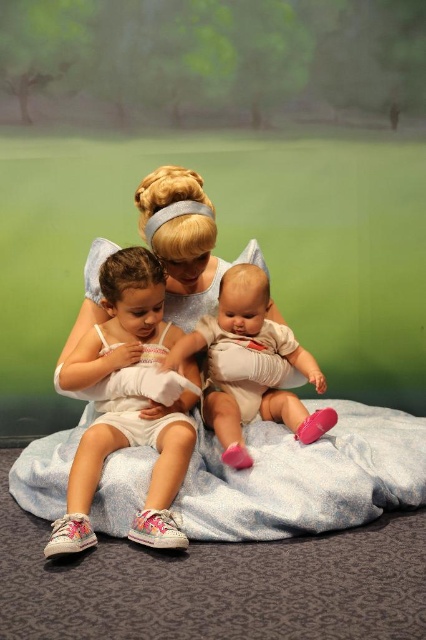
Is white soft blanket at center above white fabric dress at center?

Actually, white soft blanket at center is below white fabric dress at center.

Who is more distant from viewer, (399, 444) or (86, 445)?

Point (399, 444)

Find the location of a particular element. This screenshot has width=426, height=640. white soft blanket at center is located at coordinates (305, 476).

Who is more forward, (115, 410) or (230, 404)?

Point (115, 410)

Is point (147, 276) less distant than point (258, 337)?

That is True.

Identify the location of white fabric dress at center. The width and height of the screenshot is (426, 640). (126, 404).

Which of these two, white soft blanket at center or white cotton baby at center, stands shorter?

white soft blanket at center is shorter.

Who is more forward, (333, 400) or (307, 417)?

Positioned in front is point (307, 417).

Find the location of a particular element. white soft blanket at center is located at coordinates (305, 476).